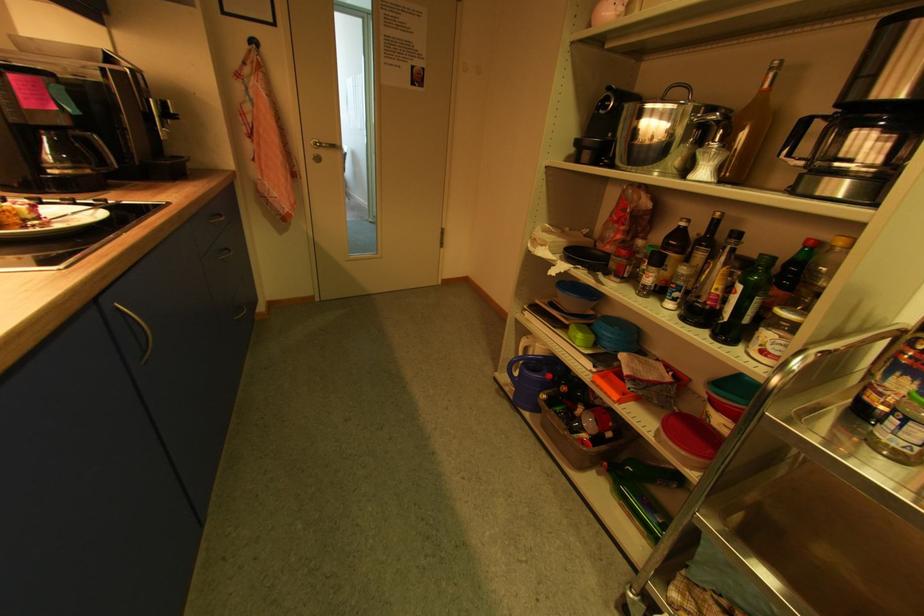
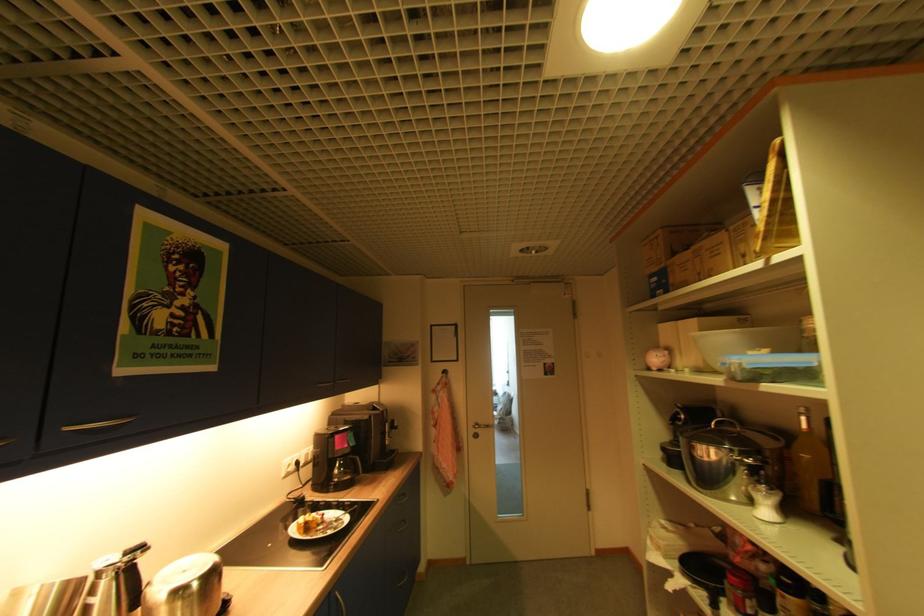
In the second image, find the point that corresponds to (x=327, y=153) in the first image.

(484, 431)